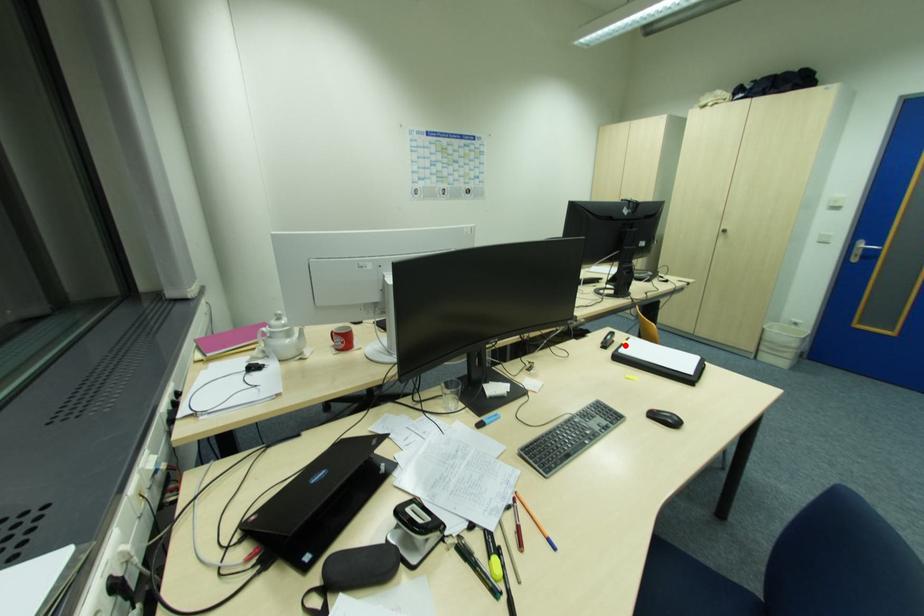
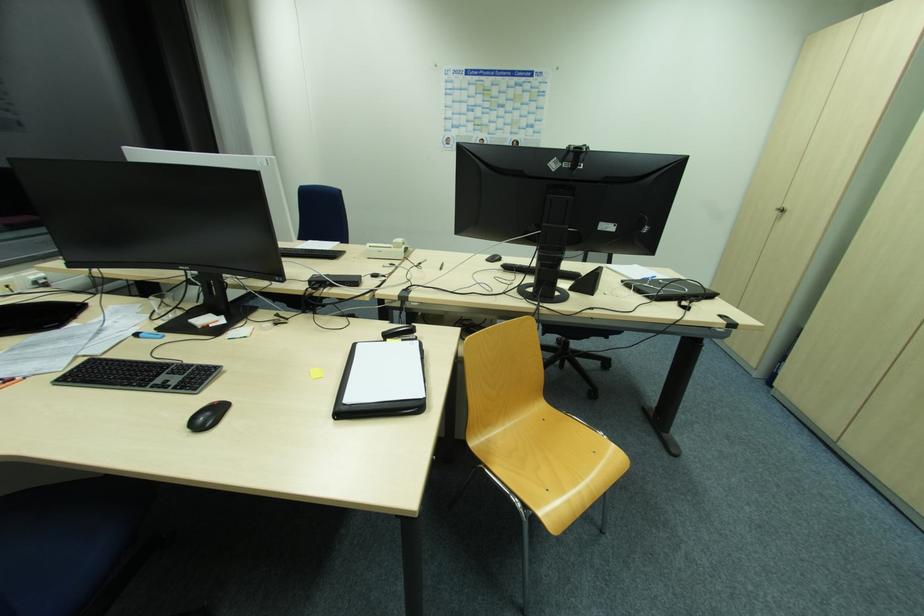
Locate, in the second image, the point that corresponds to the highlighted location in the first image.

(387, 342)